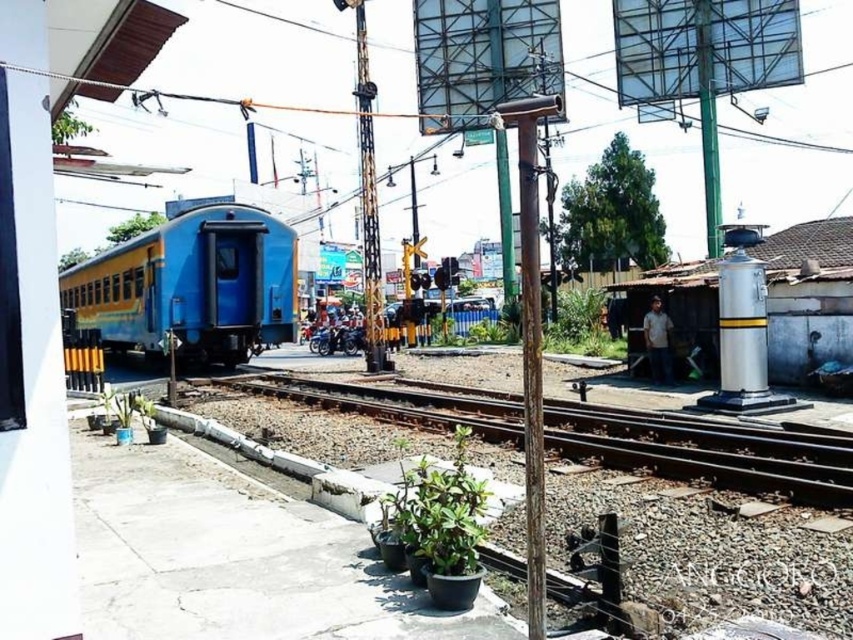
Question: Among these objects, which one is farthest from the camera?

Choices:
 (A) metallic pole at center
 (B) blue matte train at left

Answer: (A)

Question: Which point appears farthest from the camera in this image?

Choices:
 (A) (662, 349)
 (B) (643, 412)

Answer: (A)

Question: Is the position of metallic pole at center more distant than that of white shirt at right?

Choices:
 (A) yes
 (B) no

Answer: (A)

Question: Is blue matte train at left to the left of brown gravel train track at center from the viewer's perspective?

Choices:
 (A) yes
 (B) no

Answer: (A)

Question: Which object is closer to the camera taking this photo?

Choices:
 (A) metallic pole at center
 (B) blue matte train at left
 (C) brown gravel train track at center

Answer: (B)

Question: Can you confirm if brown gravel train track at center is positioned to the right of white shirt at right?

Choices:
 (A) no
 (B) yes

Answer: (A)